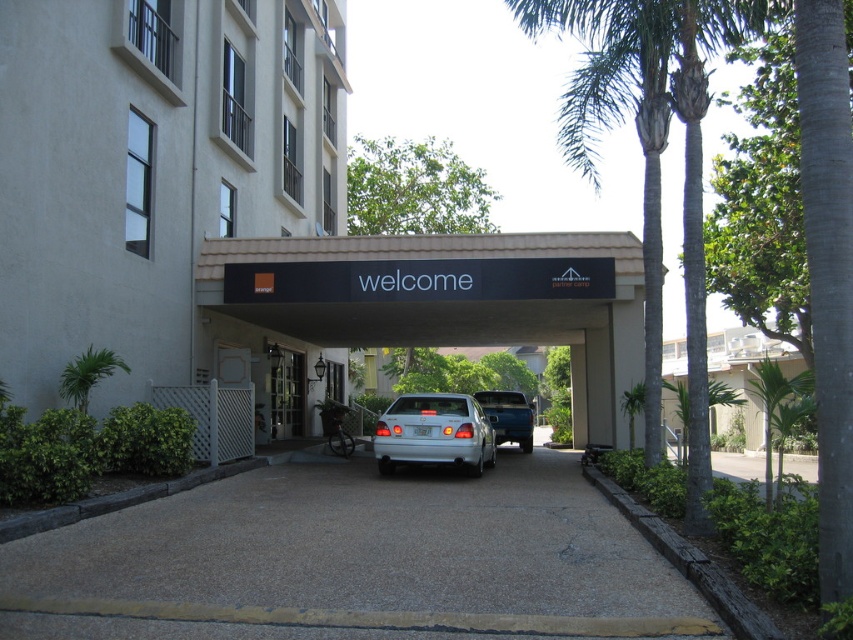
Question: Does green leafy palm tree at center appear over white glossy sedan at center?

Choices:
 (A) no
 (B) yes

Answer: (B)

Question: Does green leafy palm tree at center have a lesser width compared to green leafy palm tree at lower left?

Choices:
 (A) no
 (B) yes

Answer: (A)

Question: Estimate the real-world distances between objects in this image. Which object is closer to the green leafy palm tree at lower left?

Choices:
 (A) white concrete building at right
 (B) green leafy palm tree at center
 (C) clear glass door at center

Answer: (C)

Question: Based on their relative distances, which object is farther from the matte white building at center?

Choices:
 (A) black matte sign at center
 (B) metallic silver truck at center

Answer: (B)

Question: Is green leafy palm tree at lower left wider than metallic silver truck at center?

Choices:
 (A) yes
 (B) no

Answer: (A)

Question: Which object appears farthest from the camera in this image?

Choices:
 (A) green leafy palm tree at lower left
 (B) white concrete building at right
 (C) white glossy sedan at center
 (D) green leafy palm tree at center

Answer: (B)